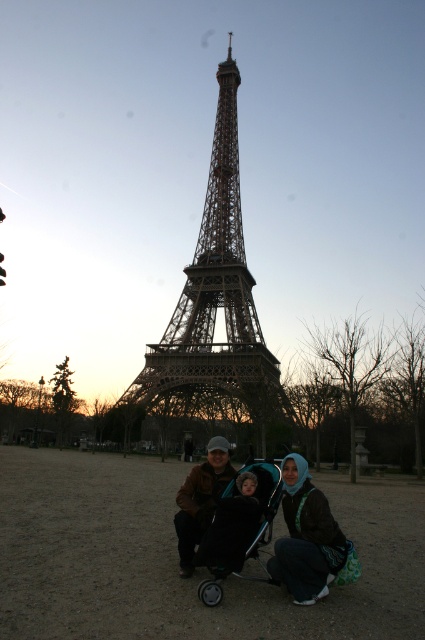
Question: Which point is closer to the camera?

Choices:
 (A) (224, 138)
 (B) (193, 477)
 (C) (251, 547)

Answer: (C)

Question: Does dark brown leather jacket at center have a smaller size compared to green fabric hijab at center?

Choices:
 (A) yes
 (B) no

Answer: (B)

Question: Which is nearer to the dark brown leather jacket at center?

Choices:
 (A) metallic structure at center
 (B) teal fabric baby carriage at center

Answer: (B)

Question: Can you confirm if metallic structure at center is thinner than teal fabric baby carriage at center?

Choices:
 (A) no
 (B) yes

Answer: (A)

Question: Is dark brown leather jacket at center below brown leather jacket at center?

Choices:
 (A) yes
 (B) no

Answer: (A)

Question: Among these points, which one is nearest to the camera?

Choices:
 (A) (306, 468)
 (B) (212, 244)
 (C) (320, 566)
 (D) (201, 513)

Answer: (C)